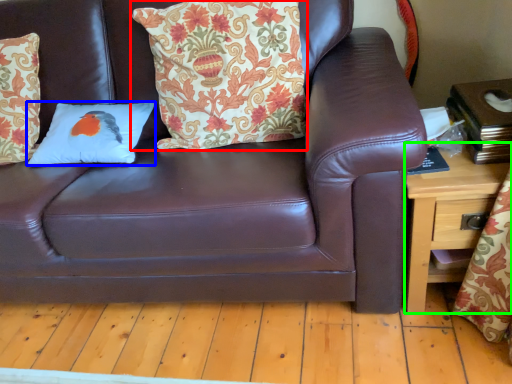
Question: Based on their relative distances, which object is farther from pillow (highlighted by a red box)? Choose from pillow (highlighted by a blue box) and table (highlighted by a green box).

Choices:
 (A) pillow
 (B) table

Answer: (B)